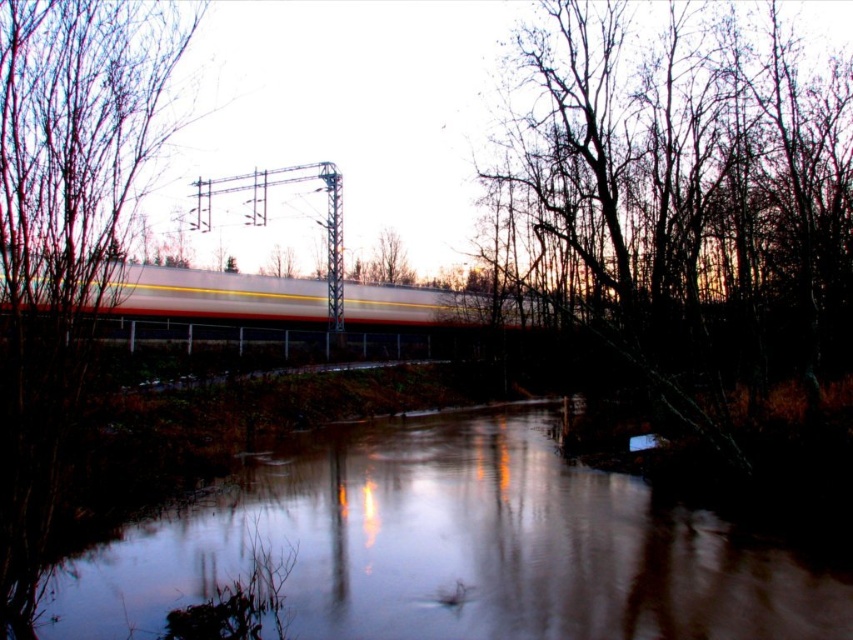
You are standing at the edge of the water and want to place a small boat exactly at the center of the smooth reflective water at center. According to the coordinates provided, where should you place the boat?

The boat should be placed at the coordinates point (450, 548), which is the center of the smooth reflective water at center.

You are standing at the edge of the water and want to take a photo of the dark brown bark tree at right and the smooth reflective water at center. Which object is closer to you?

The smooth reflective water at center is located below the dark brown bark tree at right, meaning the tree is closer to you than the water.

You are standing on the bank of the water and want to take a photo of both the smooth reflective water at center and the dark brown bark tree at right. Which object will appear larger in the photo?

The dark brown bark tree at right will appear larger in the photo because it is bigger than the smooth reflective water at center.